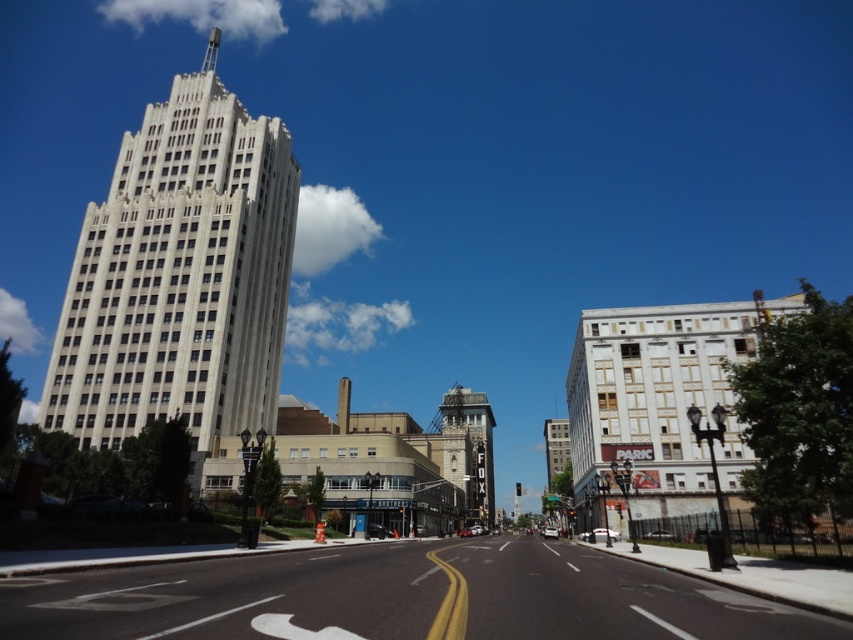
Question: Is white stone building at left further to the viewer compared to gray stone clock tower at center?

Choices:
 (A) no
 (B) yes

Answer: (A)

Question: Which of the following is the farthest from the observer?

Choices:
 (A) gray stone clock tower at center
 (B) white stone building at left

Answer: (A)

Question: Does white stone building at left appear under gray stone clock tower at center?

Choices:
 (A) no
 (B) yes

Answer: (A)

Question: Is white stone building at left smaller than gray stone clock tower at center?

Choices:
 (A) yes
 (B) no

Answer: (A)

Question: Among these points, which one is nearest to the camera?

Choices:
 (A) (204, 445)
 (B) (483, 408)

Answer: (A)